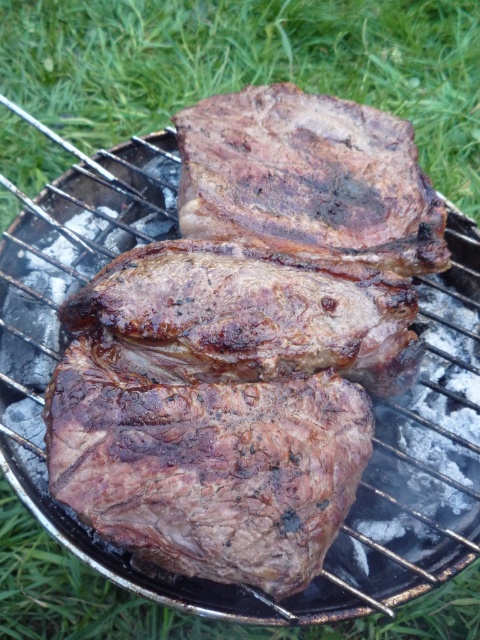
Question: Is green grass at upper center above charred seared steak at center?

Choices:
 (A) no
 (B) yes

Answer: (B)

Question: Which of the following is the closest to the observer?

Choices:
 (A) charred seared steak at center
 (B) green grass at upper center

Answer: (A)

Question: Can you confirm if green grass at upper center is smaller than charred seared steak at center?

Choices:
 (A) yes
 (B) no

Answer: (B)

Question: Which point is closer to the camera?

Choices:
 (A) charred seared steak at center
 (B) green grass at upper center

Answer: (A)

Question: Is green grass at upper center thinner than charred seared steak at center?

Choices:
 (A) yes
 (B) no

Answer: (B)